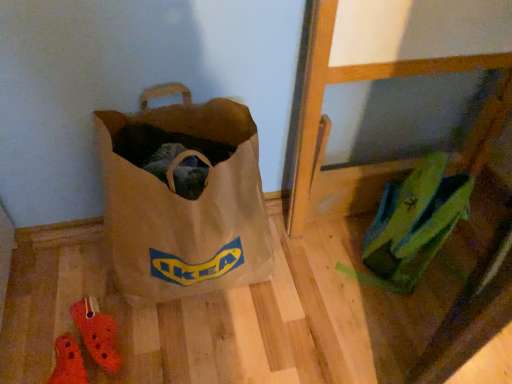
Locate an element on the screen. The height and width of the screenshot is (384, 512). vacant space to the left of orange croc at lower left, the 1th footwear viewed from the top is located at coordinates (38, 327).